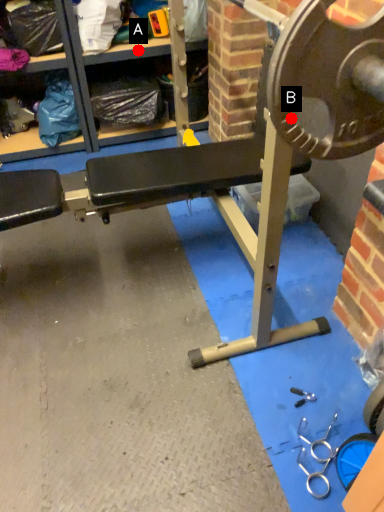
Question: Two points are circled on the image, labeled by A and B beside each circle. Among these points, which one is farthest from the camera?

Choices:
 (A) A is further
 (B) B is further

Answer: (A)